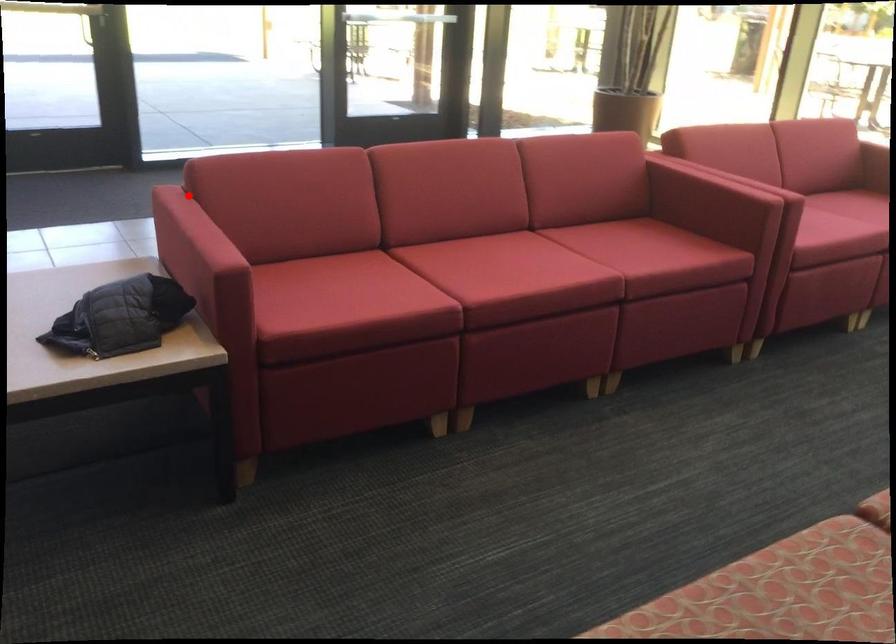
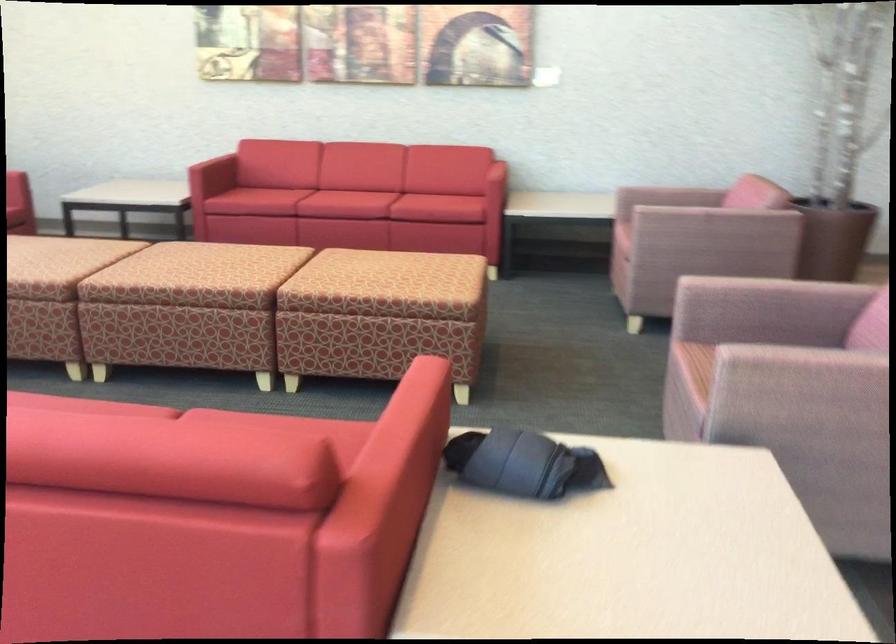
Question: I am providing you with two images of the same scene from different viewpoints. In image1, a red point is highlighted. Considering the same 3D point in image2, which of the following is correct?

Choices:
 (A) It is closer
 (B) It is farther

Answer: (A)